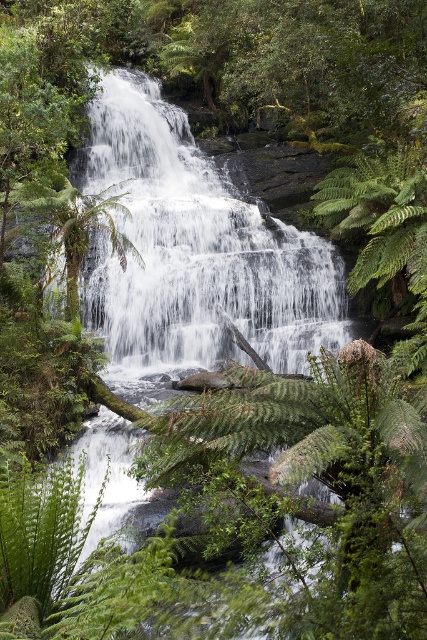
You are a photographer trying to capture the white frothy water at center. Based on the scene description, where should you aim your camera to focus?

You should aim your camera at point (193, 252) to focus on the white frothy water at center.